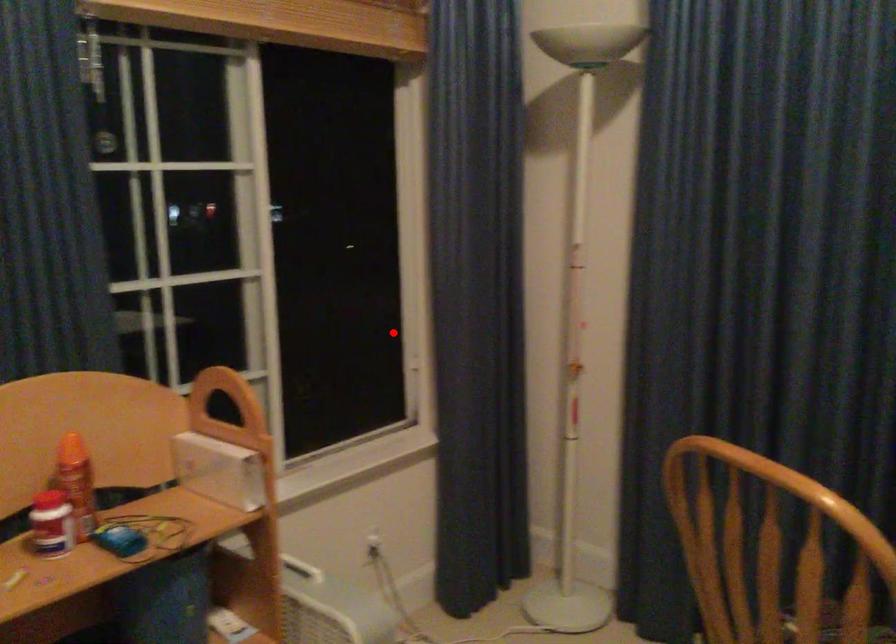
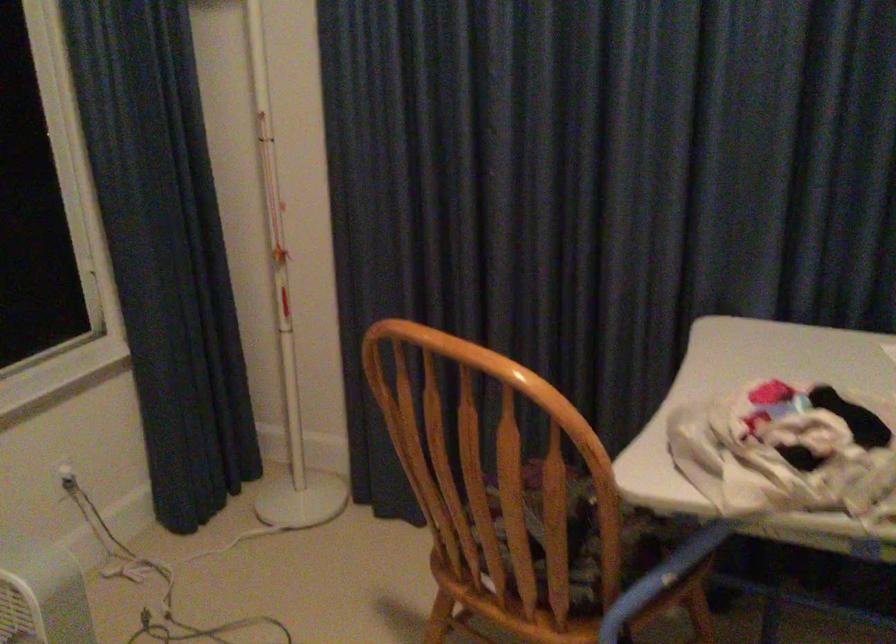
Question: I am providing you with two images of the same scene from different viewpoints. Image1 has a red point marked. In image2, the corresponding 3D location appears at what relative position? Reply with the corresponding letter.

Choices:
 (A) Closer
 (B) Farther

Answer: (A)